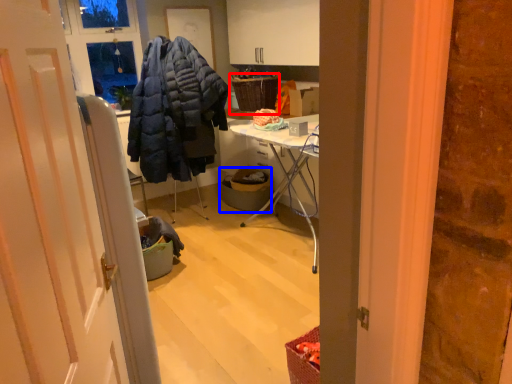
Question: Among these objects, which one is farthest to the camera, picnic basket (highlighted by a red box) or trash bin/can (highlighted by a blue box)?

Choices:
 (A) picnic basket
 (B) trash bin/can

Answer: (A)